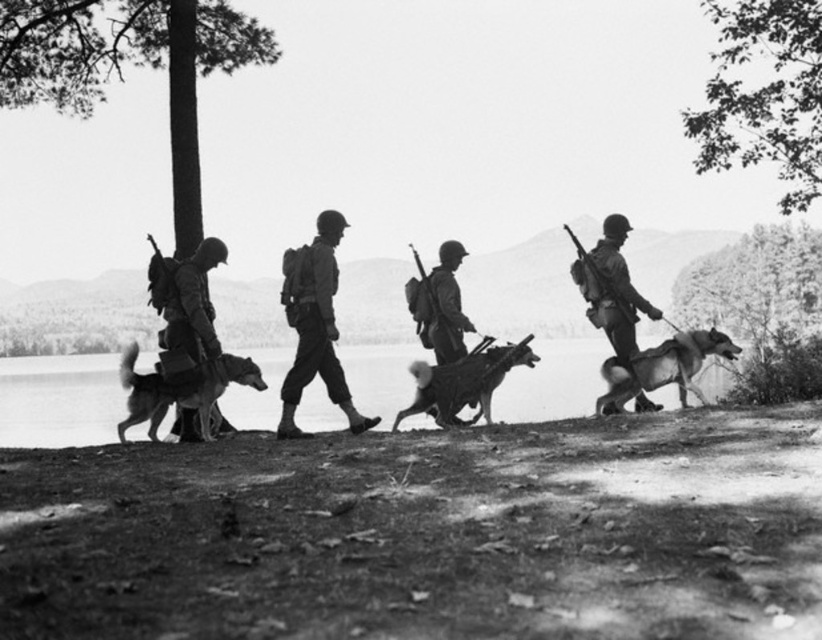
Between matte black uniform at center and brushed metal helmet at left, which one is positioned lower?

matte black uniform at center

Describe the element at coordinates (315, 324) in the screenshot. I see `matte black uniform at center` at that location.

Between point (344, 378) and point (156, 273), which one is positioned behind?

Positioned behind is point (344, 378).

Find the location of a particular element. The width and height of the screenshot is (822, 640). matte black uniform at center is located at coordinates (315, 324).

Is brushed metal helmet at left shorter than metallic helmet at center?

Yes, brushed metal helmet at left is shorter than metallic helmet at center.

Is brushed metal helmet at left positioned at the back of metallic helmet at center?

That is False.

What do you see at coordinates (185, 301) in the screenshot? Image resolution: width=822 pixels, height=640 pixels. I see `brushed metal helmet at left` at bounding box center [185, 301].

Find the location of a particular element. Image resolution: width=822 pixels, height=640 pixels. brushed metal helmet at left is located at coordinates (185, 301).

Describe the element at coordinates (181, 390) in the screenshot. I see `smooth fur dog at center` at that location.

What do you see at coordinates (181, 390) in the screenshot? Image resolution: width=822 pixels, height=640 pixels. I see `smooth fur dog at center` at bounding box center [181, 390].

You are a GUI agent. You are given a task and a screenshot of the screen. Output one action in this format:
    pyautogui.click(x=<x>, y=<y>)
    Task: Click on the smooth fur dog at center
    This screenshot has height=640, width=822.
    Given the screenshot: What is the action you would take?
    pyautogui.click(x=181, y=390)